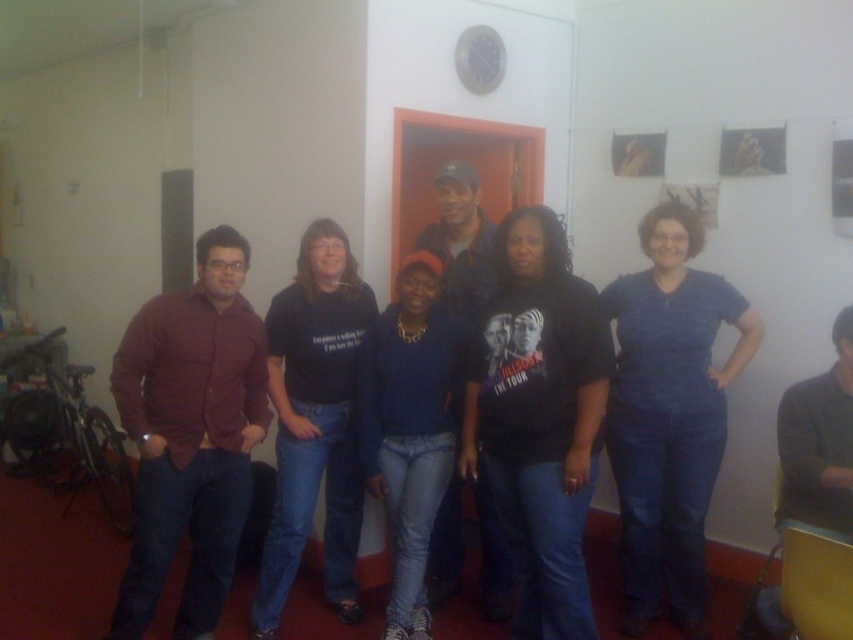
Is blue denim jeans at center thinner than black cotton shirt at center?

No, blue denim jeans at center is not thinner than black cotton shirt at center.

Is point (607, 428) positioned behind point (287, 490)?

Yes, point (607, 428) is farther from viewer.

Image resolution: width=853 pixels, height=640 pixels. Identify the location of blue denim jeans at center. (669, 413).

Is matte burgundy shirt at left wider than black cotton shirt at center?

Yes, matte burgundy shirt at left is wider than black cotton shirt at center.

What do you see at coordinates (190, 435) in the screenshot? I see `matte burgundy shirt at left` at bounding box center [190, 435].

Is point (233, 369) positioned after point (364, 300)?

No, (233, 369) is in front of (364, 300).

Where is `matte burgundy shirt at left`? Image resolution: width=853 pixels, height=640 pixels. matte burgundy shirt at left is located at coordinates (190, 435).

Between point (280, 396) and point (421, 349), which one is positioned in front?

Positioned in front is point (421, 349).

Is black cotton shirt at center positioned in front of denim jeans at center?

No, black cotton shirt at center is behind denim jeans at center.

Locate an element on the screen. This screenshot has width=853, height=640. black cotton shirt at center is located at coordinates (314, 420).